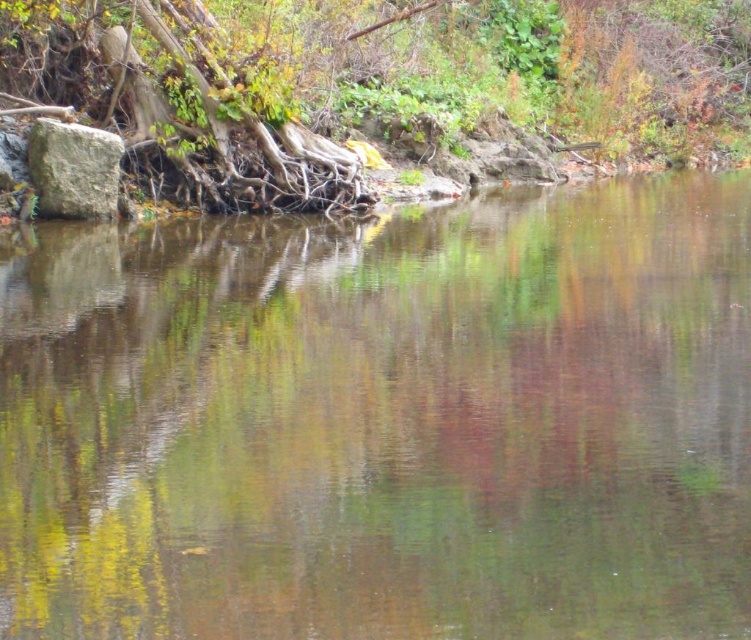
Question: Is transparent water at center in front of gray rough stone at left?

Choices:
 (A) no
 (B) yes

Answer: (B)

Question: Among these objects, which one is farthest from the camera?

Choices:
 (A) smooth brown tree roots at left
 (B) gray rough stone at left

Answer: (A)

Question: Can you confirm if transparent water at center is positioned to the right of gray rough stone at left?

Choices:
 (A) no
 (B) yes

Answer: (B)

Question: Is transparent water at center below gray rough stone at left?

Choices:
 (A) yes
 (B) no

Answer: (A)

Question: Which object is the farthest from the gray rough stone at left?

Choices:
 (A) transparent water at center
 (B) smooth brown tree roots at left

Answer: (B)

Question: Based on their relative distances, which object is nearer to the gray rough stone at left?

Choices:
 (A) smooth brown tree roots at left
 (B) transparent water at center

Answer: (B)